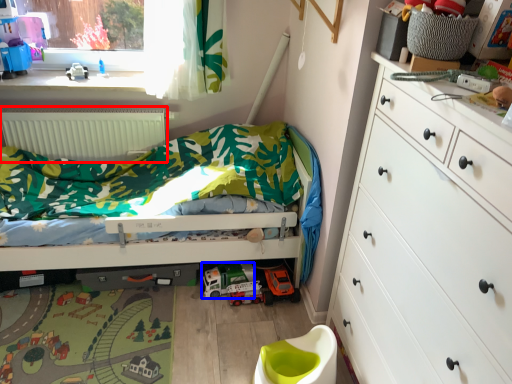
Question: Which object appears closest to the camera in this image, radiator (highlighted by a red box) or toy car (highlighted by a blue box)?

Choices:
 (A) radiator
 (B) toy car

Answer: (B)